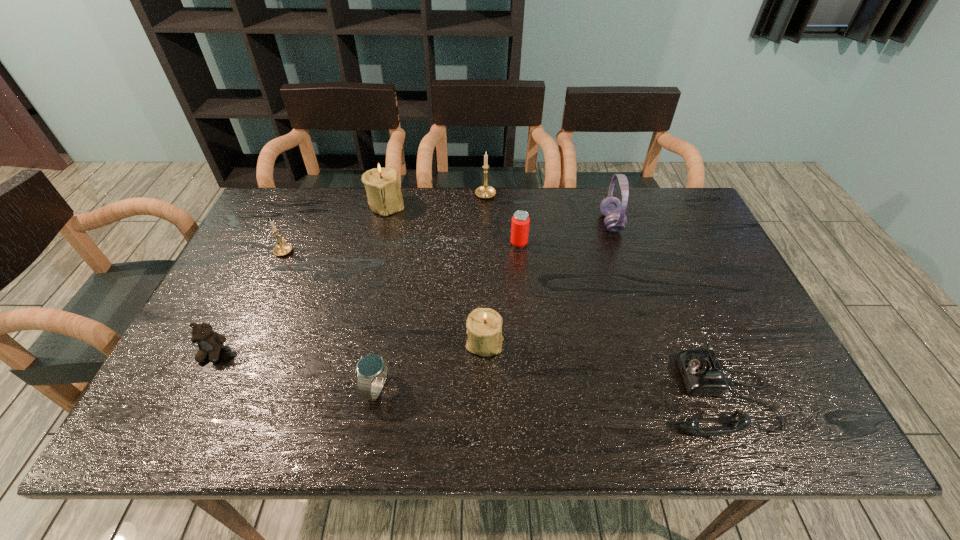
This screenshot has height=540, width=960. I want to click on the seventh object from left to right, so 520,223.

The height and width of the screenshot is (540, 960). I want to click on brown teddy bear, so click(x=209, y=342).

This screenshot has height=540, width=960. Find the location of `watch`. watch is located at coordinates (372, 369).

At what (x,y) coordinates should I click in order to perform the action: click on telephone. Please return your answer as a coordinate pair (x, y). This screenshot has height=540, width=960. Looking at the image, I should click on (702, 374).

The width and height of the screenshot is (960, 540). In order to click on vacant space located on the front of the second candle_holder from left to right in this screenshot , I will do `click(364, 299)`.

This screenshot has width=960, height=540. I want to click on free location located 0.290m on the handle side of the bigger gold candle holder, so click(x=487, y=266).

Where is `vacant space positioned 0.340m on the headband and ear cups of the headset`? This screenshot has width=960, height=540. vacant space positioned 0.340m on the headband and ear cups of the headset is located at coordinates (492, 223).

You are a GUI agent. You are given a task and a screenshot of the screen. Output one action in this format:
    pyautogui.click(x=<x>, y=<y>)
    Task: Click on the blank area located 0.370m on the headband and ear cups of the headset
    
    Given the screenshot: What is the action you would take?
    pyautogui.click(x=483, y=223)

The width and height of the screenshot is (960, 540). Find the location of `vacant space located on the headband and ear cups of the headset`. vacant space located on the headband and ear cups of the headset is located at coordinates (492, 223).

Identify the location of vacant space located 0.050m on the handle side of the nearer gold candle holder. (293, 232).